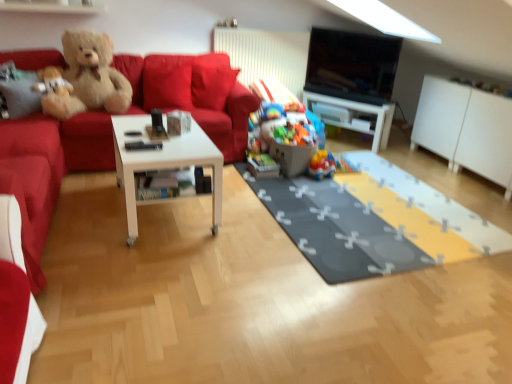
Where is `free location in front of plastic colorful toys at center, arranged as the second toy when viewed from the left`? free location in front of plastic colorful toys at center, arranged as the second toy when viewed from the left is located at coordinates (297, 184).